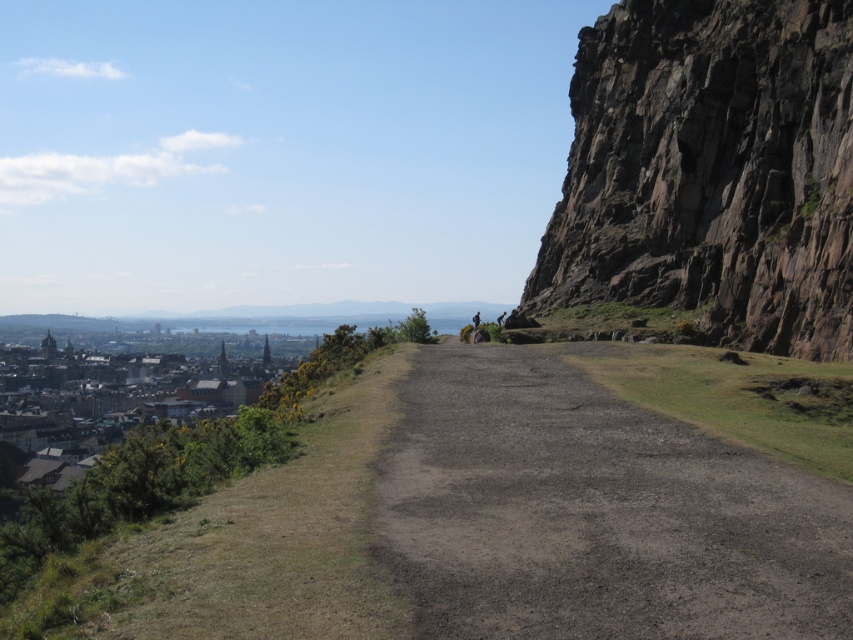
Which is behind, point (607, 108) or point (1, 419)?

Point (1, 419)

Is rugged brown rock at right wider than stone buildings at lower left?

No, rugged brown rock at right is not wider than stone buildings at lower left.

The width and height of the screenshot is (853, 640). Describe the element at coordinates (711, 170) in the screenshot. I see `rugged brown rock at right` at that location.

At what (x,y) coordinates should I click in order to perform the action: click on rugged brown rock at right. Please return your answer as a coordinate pair (x, y). Looking at the image, I should click on (711, 170).

Measure the distance from dirt/gravel path at center to dark brown leather jacket at center.

dirt/gravel path at center is 67.03 meters from dark brown leather jacket at center.

Between point (425, 376) and point (474, 317), which one is positioned behind?

Positioned behind is point (474, 317).

This screenshot has width=853, height=640. What are the coordinates of `dirt/gravel path at center` in the screenshot? It's located at (595, 513).

Does stone buildings at lower left have a greater height compared to dark brown leather jacket at center?

Yes, stone buildings at lower left is taller than dark brown leather jacket at center.

Can you confirm if stone buildings at lower left is positioned above dark brown leather jacket at center?

No, stone buildings at lower left is not above dark brown leather jacket at center.

Is point (47, 481) positioned behind point (473, 320)?

Yes, point (47, 481) is farther from viewer.

The image size is (853, 640). Find the location of `stone buildings at lower left`. stone buildings at lower left is located at coordinates (132, 412).